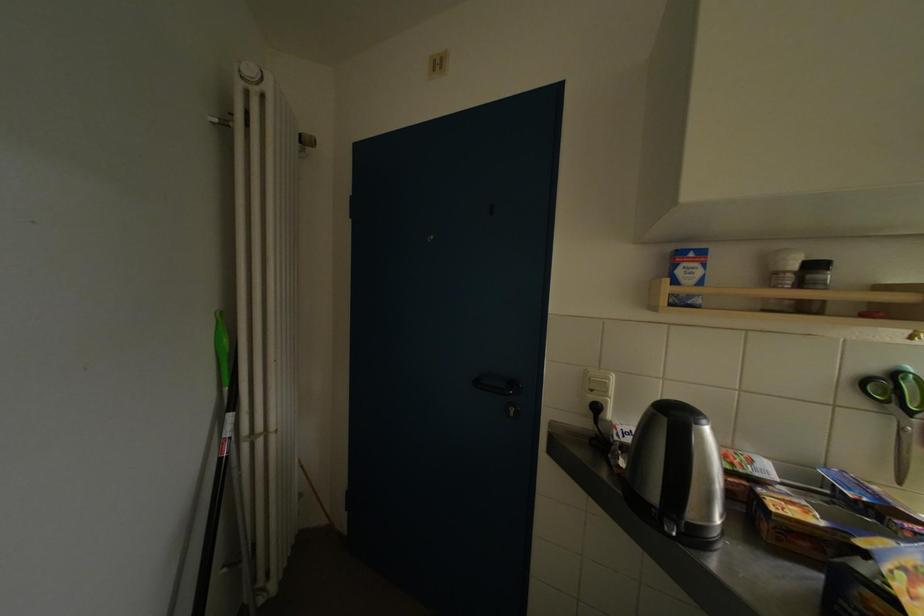
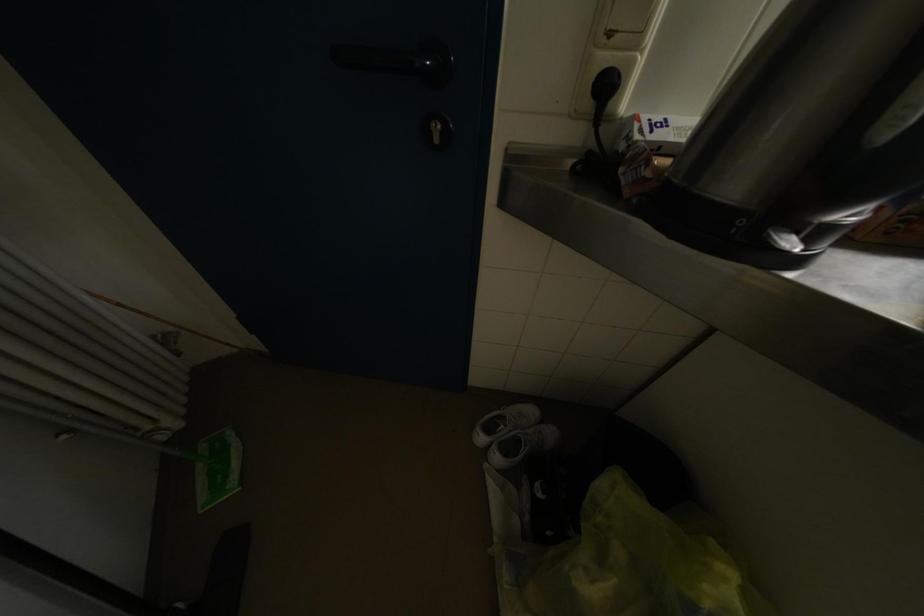
Question: How did the camera likely rotate?

Choices:
 (A) Left
 (B) Right
 (C) Up
 (D) Down

Answer: (D)